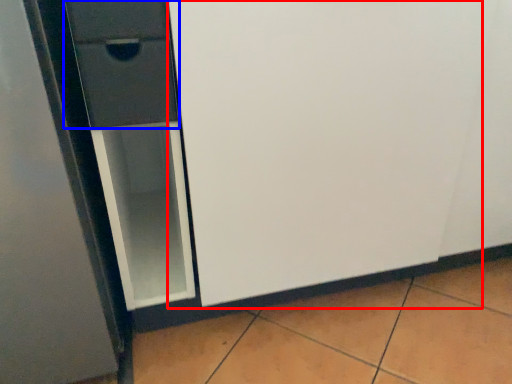
Question: Which object is closer to the camera taking this photo, screen door (highlighted by a red box) or drawer (highlighted by a blue box)?

Choices:
 (A) screen door
 (B) drawer

Answer: (A)